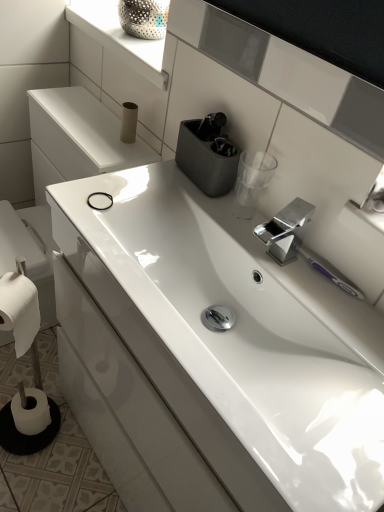
What is the approximate width of white glossy window sill at upper center?

white glossy window sill at upper center is 8.83 inches wide.

What do you see at coordinates (30, 410) in the screenshot? This screenshot has height=512, width=384. I see `white matte toilet paper at lower left, placed as the third toilet paper when sorted from right to left` at bounding box center [30, 410].

In order to face white matte toilet paper at lower left, positioned as the first toilet paper in back-to-front order, should I rotate leftwards or rightwards?

You should look left and rotate roughly 20.764 degrees.

The height and width of the screenshot is (512, 384). I want to click on matte cardboard toilet paper at upper center, positioned as the second toilet paper in back-to-front order, so pyautogui.click(x=128, y=122).

Describe the element at coordinates (19, 310) in the screenshot. This screenshot has width=384, height=512. I see `white matte toilet paper at lower left, the 2th toilet paper viewed from the left` at that location.

The width and height of the screenshot is (384, 512). What do you see at coordinates (284, 229) in the screenshot? I see `polished metallic tap at center` at bounding box center [284, 229].

The image size is (384, 512). Identify the location of polished metallic tap at center. (284, 229).

Image resolution: width=384 pixels, height=512 pixels. I want to click on white glossy sink at center, so click(235, 340).

Who is bigger, matte gray container at upper center or white glossy window sill at upper center?

Bigger between the two is white glossy window sill at upper center.

Is matte gray container at upper center positioned with its back to white glossy window sill at upper center?

No.

Who is more distant, matte gray container at upper center or white glossy window sill at upper center?

Positioned behind is white glossy window sill at upper center.

From the white matte toilet paper at lower left, the 1th toilet paper in the bottom-to-top sequence, count 2nd toilet paper to the right and point to it. Please provide its 2D coordinates.

[(128, 122)]

Do you think white matte toilet paper at lower left, the 1th toilet paper in the bottom-to-top sequence, is within matte cardboard toilet paper at upper center, which appears as the 2th toilet paper when viewed from the front, or outside of it?

The correct answer is: outside.

From a real-world perspective, which is physically above, white matte toilet paper at lower left, the 1th toilet paper in the bottom-to-top sequence, or matte cardboard toilet paper at upper center, which is the 1th toilet paper in top-to-bottom order?

From a 3D spatial view, matte cardboard toilet paper at upper center, which is the 1th toilet paper in top-to-bottom order, is above.

Which object is thinner, white matte toilet paper at lower left, the 1th toilet paper when ordered from left to right, or matte cardboard toilet paper at upper center, the 3th toilet paper viewed from the left?

matte cardboard toilet paper at upper center, the 3th toilet paper viewed from the left, is thinner.

Is white matte toilet paper at lower left, the 1th toilet paper in the bottom-to-top sequence, turned away from white glossy window sill at upper center?

white matte toilet paper at lower left, the 1th toilet paper in the bottom-to-top sequence, is not turned away from white glossy window sill at upper center.

From the image's perspective, which is above, white matte toilet paper at lower left, the 1th toilet paper when ordered from left to right, or white glossy window sill at upper center?

white glossy window sill at upper center is shown above in the image.

Which is more to the right, white matte toilet paper at lower left, the 1th toilet paper when ordered from left to right, or white glossy window sill at upper center?

Positioned to the right is white glossy window sill at upper center.

In the image, is polished metallic tap at center positioned in front of or behind white glossy sink at center?

Clearly, polished metallic tap at center is behind white glossy sink at center.

Which is correct: polished metallic tap at center is inside white glossy sink at center, or outside of it?

polished metallic tap at center lies outside white glossy sink at center.

Is polished metallic tap at center facing towards white glossy sink at center?

No, polished metallic tap at center is not turned towards white glossy sink at center.

Is polished metallic tap at center to the left or to the right of white glossy sink at center in the image?

From the image, it's evident that polished metallic tap at center is to the right of white glossy sink at center.

Which is correct: matte gray container at upper center is inside white matte toilet paper at lower left, which ranks as the 2th toilet paper in right-to-left order, or outside of it?

matte gray container at upper center cannot be found inside white matte toilet paper at lower left, which ranks as the 2th toilet paper in right-to-left order.

Is matte gray container at upper center aimed at white matte toilet paper at lower left, placed as the third toilet paper when sorted from back to front?

No, matte gray container at upper center is not turned towards white matte toilet paper at lower left, placed as the third toilet paper when sorted from back to front.

In the image, is matte gray container at upper center on the left side or the right side of white matte toilet paper at lower left, which ranks as the 2th toilet paper in right-to-left order?

matte gray container at upper center is to the right of white matte toilet paper at lower left, which ranks as the 2th toilet paper in right-to-left order.

Does point (122, 120) come closer to viewer compared to point (258, 455)?

That is False.

Between matte cardboard toilet paper at upper center, the first toilet paper viewed from the right, and white glossy sink at center, which one is positioned behind?

matte cardboard toilet paper at upper center, the first toilet paper viewed from the right.

From a real-world perspective, is matte cardboard toilet paper at upper center, positioned as the second toilet paper in back-to-front order, located higher than white glossy sink at center?

Yes.

Based on the photo, is matte cardboard toilet paper at upper center, the first toilet paper viewed from the right, positioned with its back to white glossy sink at center?

No, matte cardboard toilet paper at upper center, the first toilet paper viewed from the right, is not facing the opposite direction of white glossy sink at center.

Can you confirm if white glossy sink at center is smaller than white glossy window sill at upper center?

No, white glossy sink at center is not smaller than white glossy window sill at upper center.

Considering the positions of objects white glossy sink at center and white glossy window sill at upper center in the image provided, who is behind, white glossy sink at center or white glossy window sill at upper center?

white glossy window sill at upper center is further away from the camera.

Which point is more forward, (375, 484) or (73, 13)?

Point (375, 484)

From a real-world perspective, is white glossy sink at center over white glossy window sill at upper center?

Incorrect, from a real-world perspective, white glossy sink at center is lower than white glossy window sill at upper center.

You are a GUI agent. You are given a task and a screenshot of the screen. Output one action in this format:
    pyautogui.click(x=<x>, y=<y>)
    Task: Click on the window sill that appears above the matte gray container at upper center (from the image's perspective)
    The image size is (384, 512).
    Given the screenshot: What is the action you would take?
    pyautogui.click(x=119, y=38)

From the white matte toilet paper at lower left, the third toilet paper from the front, count 1st toilet papers forward and point to it. Please provide its 2D coordinates.

[(128, 122)]

Consider the image. Looking at the image, which one is located closer to polished metallic tap at center, matte cardboard toilet paper at upper center, which appears as the 2th toilet paper when viewed from the front, or white glossy window sill at upper center?

matte cardboard toilet paper at upper center, which appears as the 2th toilet paper when viewed from the front, is closer to polished metallic tap at center.

Considering their positions, is white glossy sink at center positioned closer to white matte toilet paper at lower left, which ranks as the 2th toilet paper in right-to-left order, than polished metallic tap at center?

white glossy sink at center lies closer to white matte toilet paper at lower left, which ranks as the 2th toilet paper in right-to-left order, than the other object.

Estimate the real-world distances between objects in this image. Which object is closer to white glossy window sill at upper center, matte cardboard toilet paper at upper center, which is the 1th toilet paper in top-to-bottom order, or white matte toilet paper at lower left, positioned as the first toilet paper in back-to-front order?

matte cardboard toilet paper at upper center, which is the 1th toilet paper in top-to-bottom order, lies closer to white glossy window sill at upper center than the other object.

When comparing their distances from matte cardboard toilet paper at upper center, the third toilet paper positioned from the bottom, does white matte toilet paper at lower left, placed as the third toilet paper when sorted from right to left, or white glossy window sill at upper center seem further?

Among the two, white matte toilet paper at lower left, placed as the third toilet paper when sorted from right to left, is located further to matte cardboard toilet paper at upper center, the third toilet paper positioned from the bottom.

Considering their positions, is white matte toilet paper at lower left, placed as the third toilet paper when sorted from back to front, positioned closer to white matte toilet paper at lower left, the 1th toilet paper in the bottom-to-top sequence, than white glossy sink at center?

Among the two, white matte toilet paper at lower left, placed as the third toilet paper when sorted from back to front, is located nearer to white matte toilet paper at lower left, the 1th toilet paper in the bottom-to-top sequence.

Looking at the image, which one is located closer to white glossy sink at center, matte gray container at upper center or matte cardboard toilet paper at upper center, positioned as the second toilet paper in back-to-front order?

Based on the image, matte gray container at upper center appears to be nearer to white glossy sink at center.

Based on their spatial positions, is matte cardboard toilet paper at upper center, the first toilet paper viewed from the right, or white glossy window sill at upper center further from white glossy sink at center?

matte cardboard toilet paper at upper center, the first toilet paper viewed from the right, is further to white glossy sink at center.

Estimate the real-world distances between objects in this image. Which object is closer to white glossy sink at center, matte gray container at upper center or polished metallic tap at center?

polished metallic tap at center is positioned closer to the anchor white glossy sink at center.

I want to click on sink that lies between matte cardboard toilet paper at upper center, which is the 1th toilet paper in top-to-bottom order, and white matte toilet paper at lower left, which ranks as the 3th toilet paper in top-to-bottom order, from top to bottom, so click(x=235, y=340).

The image size is (384, 512). I want to click on appliance located between polished metallic tap at center and matte cardboard toilet paper at upper center, positioned as the second toilet paper in back-to-front order, in the depth direction, so click(207, 154).

The image size is (384, 512). What are the coordinates of `appliance between white glossy window sill at upper center and white glossy sink at center in the vertical direction` in the screenshot? It's located at (207, 154).

Locate an element on the screen. The image size is (384, 512). tap between white glossy window sill at upper center and white matte toilet paper at lower left, which ranks as the 2th toilet paper in right-to-left order, from top to bottom is located at coordinates (284, 229).